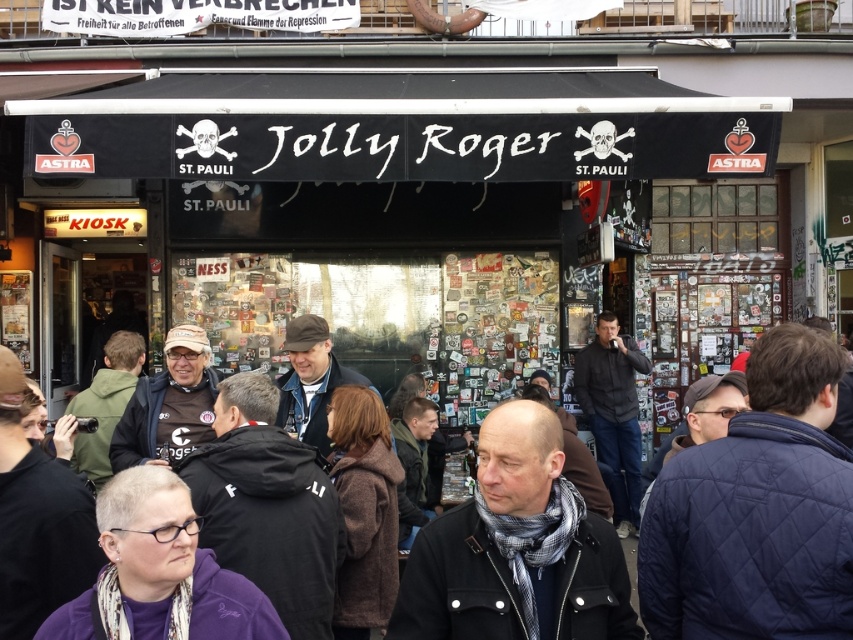
How distant is dark gray wool scarf at center from dark gray jacket at center?

dark gray wool scarf at center and dark gray jacket at center are 22.08 feet apart.

Who is lower down, dark gray wool scarf at center or dark gray jacket at center?

dark gray jacket at center is below.

Between point (511, 403) and point (614, 442), which one is positioned behind?

Positioned behind is point (614, 442).

At what (x,y) coordinates should I click in order to perform the action: click on dark gray wool scarf at center. Please return your answer as a coordinate pair (x, y). The image size is (853, 640). Looking at the image, I should click on (515, 548).

Does dark brown leather jacket at center have a larger size compared to dark gray jacket at center?

Correct, dark brown leather jacket at center is larger in size than dark gray jacket at center.

Does dark brown leather jacket at center appear on the right side of dark gray jacket at center?

No, dark brown leather jacket at center is not to the right of dark gray jacket at center.

Between point (526, 508) and point (604, 396), which one is positioned in front?

Point (526, 508) is more forward.

The height and width of the screenshot is (640, 853). I want to click on dark brown leather jacket at center, so click(x=756, y=509).

Does point (836, 368) lie in front of point (527, 490)?

Yes, point (836, 368) is in front of point (527, 490).

Is dark brown leather jacket at center wider than dark gray wool scarf at center?

Yes, dark brown leather jacket at center is wider than dark gray wool scarf at center.

What do you see at coordinates (756, 509) in the screenshot? Image resolution: width=853 pixels, height=640 pixels. I see `dark brown leather jacket at center` at bounding box center [756, 509].

Where is `dark brown leather jacket at center`? This screenshot has height=640, width=853. dark brown leather jacket at center is located at coordinates (756, 509).